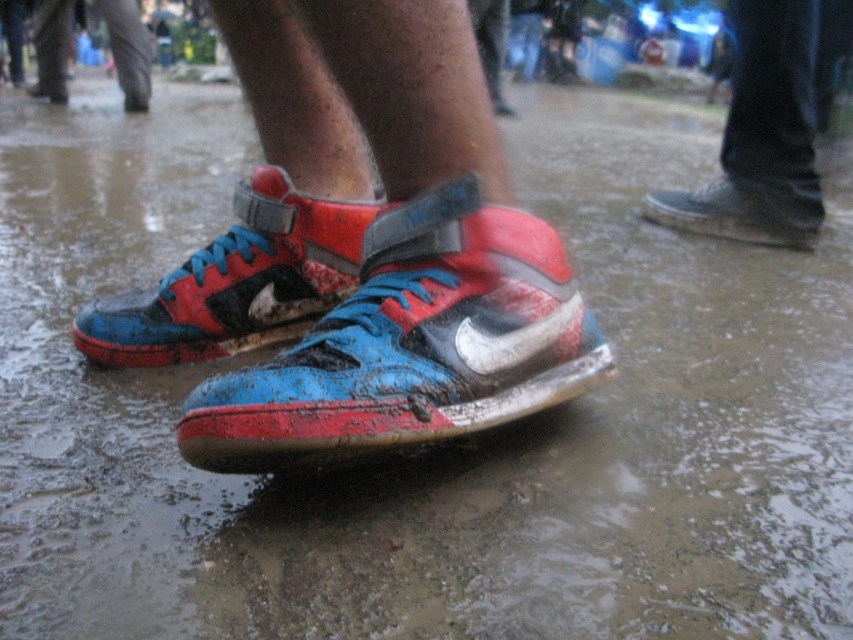
Looking at this image, you are trying to decide which pair of shoes to take for a muddy trail walk. You have two options in front of you, the shiny leather sneakers at center and the matte black shoe at center. Based on their sizes, which one might be more comfortable for walking long distances?

The shiny leather sneakers at center is wider than the matte black shoe at center, so it might be more comfortable for walking long distances as wider shoes often provide better support and comfort over extended periods.

You are a photographer trying to capture the reflection of the blue suede shoe at upper right in the wet ground. Since the matte black shoe at center is blocking the view, can you move it to the side to get a clear shot? Explain why or why not based on their positions.

The matte black shoe at center is in front of the blue suede shoe at upper right, so moving the matte black shoe at center to the side would allow the blue suede shoe at upper right to be visible and its reflection in the wet ground could be captured.

You are a photographer trying to capture the shiny leather sneakers at center and the matte black shoe at center. Which one will appear more detailed in your photo?

The shiny leather sneakers at center will appear more detailed in the photo because it is closer to the viewer than the matte black shoe at center.